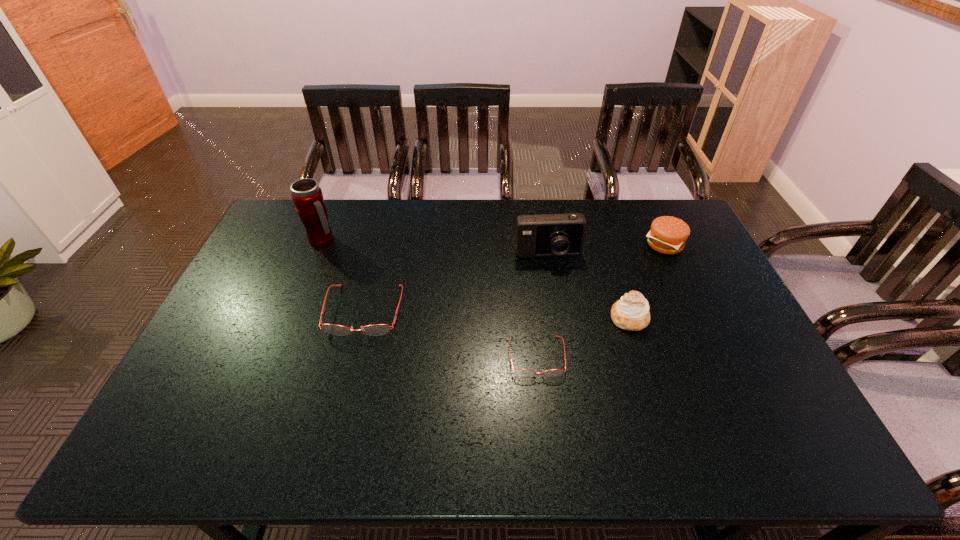
Given the evenly spaced spectacless in the image, where should an extra spectacles be added on the right to preserve the spacing? Please point to a vacant space. Please provide its 2D coordinates. Your answer should be formatted as a tuple, i.e. [(x, y)], where the tuple contains the x and y coordinates of a point satisfying the conditions above.

[(747, 412)]